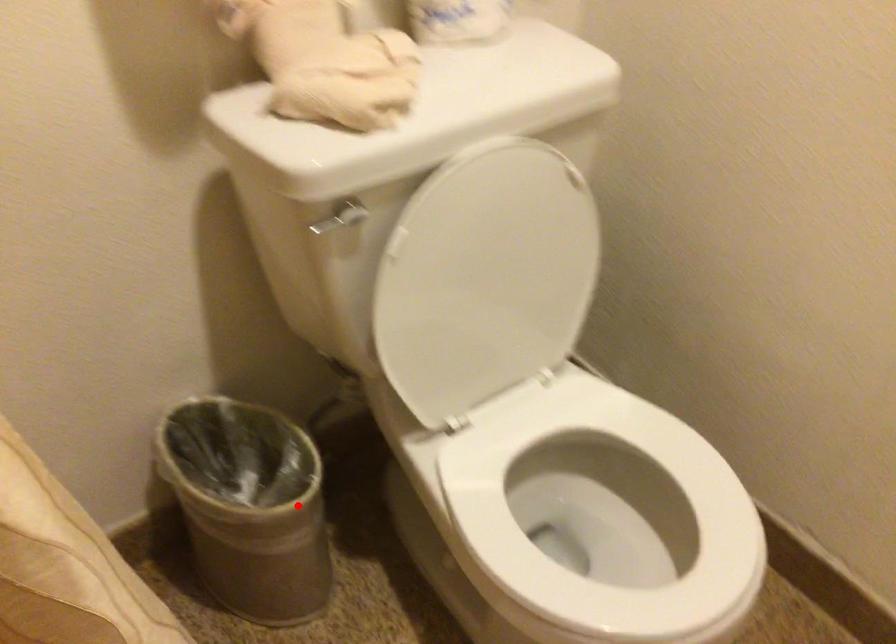
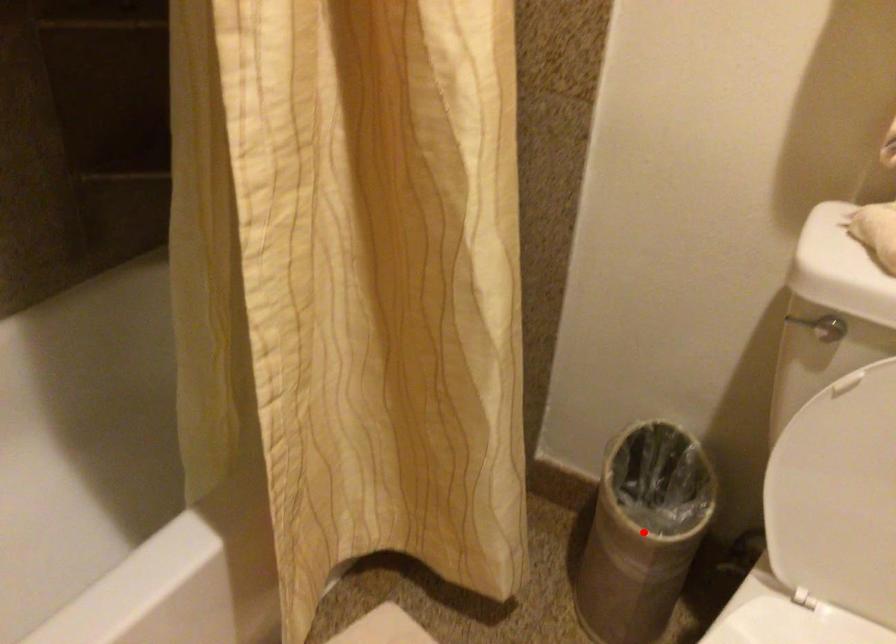
I am providing you with two images of the same scene from different viewpoints. A red point is marked on the first image and another point is marked on the second image. Is the red point in image1 aligned with the point shown in image2?

Yes